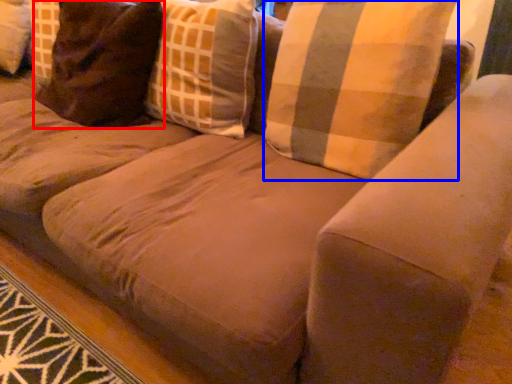
Question: Among these objects, which one is nearest to the camera, pillow (highlighted by a red box) or pillow (highlighted by a blue box)?

Choices:
 (A) pillow
 (B) pillow

Answer: (B)